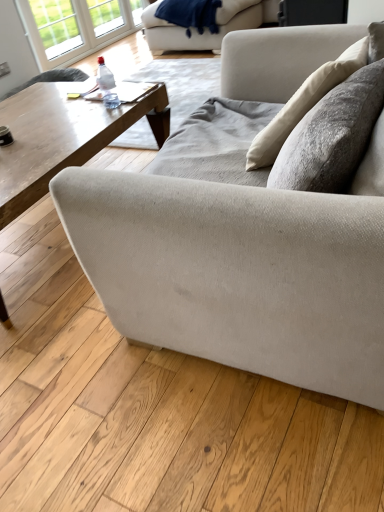
In order to click on white glass window at upper left, the first window in the right-to-left sequence in this screenshot , I will do `click(76, 27)`.

Where is `beige fabric couch at upper center, which ranks as the second studio couch in bottom-to-top order`? beige fabric couch at upper center, which ranks as the second studio couch in bottom-to-top order is located at coordinates (206, 28).

What do you see at coordinates (206, 28) in the screenshot? This screenshot has width=384, height=512. I see `beige fabric couch at upper center, placed as the first studio couch when sorted from back to front` at bounding box center [206, 28].

The height and width of the screenshot is (512, 384). Describe the element at coordinates (62, 137) in the screenshot. I see `wooden coffee table at center` at that location.

In order to click on wooden coffee table at center in this screenshot , I will do 62,137.

The height and width of the screenshot is (512, 384). Identify the location of clear glass window at upper left, which is the first window from left to right. (56, 26).

Can you confirm if white glass window at upper left, the first window in the right-to-left sequence, is shorter than textured beige couch at center, positioned as the 1th studio couch in front-to-back order?

Yes.

Is white glass window at upper left, the first window in the right-to-left sequence, oriented towards textured beige couch at center, the first studio couch in the bottom-to-top sequence?

→ No, white glass window at upper left, the first window in the right-to-left sequence, does not turn towards textured beige couch at center, the first studio couch in the bottom-to-top sequence.

Which object is positioned more to the left, white glass window at upper left, which is the 2th window in left-to-right order, or textured beige couch at center, the 2th studio couch positioned from the back?

From the viewer's perspective, white glass window at upper left, which is the 2th window in left-to-right order, appears more on the left side.

In the image, is white glass window at upper left, which is the 2th window in left-to-right order, positioned in front of or behind textured beige couch at center, the first studio couch in the bottom-to-top sequence?

Visually, white glass window at upper left, which is the 2th window in left-to-right order, is located behind textured beige couch at center, the first studio couch in the bottom-to-top sequence.

Does wooden coffee table at center appear on the right side of textured beige couch at center, positioned as the second studio couch in top-to-bottom order?

No.

Who is smaller, wooden coffee table at center or textured beige couch at center, positioned as the second studio couch in top-to-bottom order?

With smaller size is wooden coffee table at center.

From the image's perspective, is wooden coffee table at center positioned above or below textured beige couch at center, positioned as the second studio couch in top-to-bottom order?

Based on their image positions, wooden coffee table at center is located above textured beige couch at center, positioned as the second studio couch in top-to-bottom order.

Is wooden coffee table at center taller or shorter than textured beige couch at center, the first studio couch in the bottom-to-top sequence?

Clearly, wooden coffee table at center is shorter compared to textured beige couch at center, the first studio couch in the bottom-to-top sequence.

Is point (176, 4) positioned before point (105, 11)?

That is True.

Can you confirm if velvety blue blanket at upper center is wider than white glass window at upper left, the first window in the right-to-left sequence?

Yes.

From a real-world perspective, is velvety blue blanket at upper center beneath white glass window at upper left, which is the 2th window in left-to-right order?

Actually, velvety blue blanket at upper center is physically above white glass window at upper left, which is the 2th window in left-to-right order, in the real world.

Is there a large distance between velvety blue blanket at upper center and white glass window at upper left, which is the 2th window in left-to-right order?

Absolutely, velvety blue blanket at upper center is distant from white glass window at upper left, which is the 2th window in left-to-right order.

Is textured beige couch at center, positioned as the 1th studio couch in front-to-back order, turned away from beige fabric couch at upper center, the first studio couch in the top-to-bottom sequence?

No, textured beige couch at center, positioned as the 1th studio couch in front-to-back order,'s orientation is not away from beige fabric couch at upper center, the first studio couch in the top-to-bottom sequence.

Are textured beige couch at center, the first studio couch in the bottom-to-top sequence, and beige fabric couch at upper center, placed as the first studio couch when sorted from back to front, far apart?

That's right, there is a large distance between textured beige couch at center, the first studio couch in the bottom-to-top sequence, and beige fabric couch at upper center, placed as the first studio couch when sorted from back to front.

Considering the positions of point (292, 86) and point (257, 20), is point (292, 86) closer or farther from the camera than point (257, 20)?

Point (292, 86) is positioned closer to the camera compared to point (257, 20).

From a real-world perspective, which object stands above the other?

clear glass window at upper left, the second window viewed from the right.

Is clear glass window at upper left, which is the first window from left to right, not inside wooden coffee table at center?

clear glass window at upper left, which is the first window from left to right, lies outside wooden coffee table at center's area.

Is clear glass window at upper left, the second window viewed from the right, with wooden coffee table at center?

clear glass window at upper left, the second window viewed from the right, and wooden coffee table at center are not in contact.

Which of these two, clear glass window at upper left, the second window viewed from the right, or wooden coffee table at center, is wider?

wooden coffee table at center.

From the image's perspective, is velvety blue blanket at upper center above textured beige couch at center, the 2th studio couch positioned from the back?

Indeed, from the image's perspective, velvety blue blanket at upper center is shown above textured beige couch at center, the 2th studio couch positioned from the back.

The width and height of the screenshot is (384, 512). In order to click on blanket on the left of textured beige couch at center, positioned as the 1th studio couch in front-to-back order in this screenshot , I will do `click(190, 14)`.

Is velvety blue blanket at upper center smaller than textured beige couch at center, positioned as the 1th studio couch in front-to-back order?

Yes.

Is textured beige couch at center, positioned as the 1th studio couch in front-to-back order, a part of velvety blue blanket at upper center?

No, textured beige couch at center, positioned as the 1th studio couch in front-to-back order, is located outside of velvety blue blanket at upper center.

Which object is further away from the camera, beige fabric couch at upper center, placed as the first studio couch when sorted from back to front, or textured beige couch at center, the first studio couch in the bottom-to-top sequence?

beige fabric couch at upper center, placed as the first studio couch when sorted from back to front, is more distant.

Which of these two, beige fabric couch at upper center, which ranks as the second studio couch in bottom-to-top order, or textured beige couch at center, positioned as the 1th studio couch in front-to-back order, is smaller?

beige fabric couch at upper center, which ranks as the second studio couch in bottom-to-top order.

Measure the distance between beige fabric couch at upper center, which ranks as the second studio couch in bottom-to-top order, and textured beige couch at center, the first studio couch in the bottom-to-top sequence.

beige fabric couch at upper center, which ranks as the second studio couch in bottom-to-top order, and textured beige couch at center, the first studio couch in the bottom-to-top sequence, are 3.45 meters apart.

Can you see beige fabric couch at upper center, the second studio couch positioned from the front, touching textured beige couch at center, positioned as the 1th studio couch in front-to-back order?

No, beige fabric couch at upper center, the second studio couch positioned from the front, is not beside textured beige couch at center, positioned as the 1th studio couch in front-to-back order.

Locate an element on the screen. The width and height of the screenshot is (384, 512). the 2nd window located beneath the textured beige couch at center, the 2th studio couch positioned from the back (from a real-world perspective) is located at coordinates (76, 27).

Identify the location of coffee table on the left of the textured beige couch at center, positioned as the 1th studio couch in front-to-back order. This screenshot has width=384, height=512. (62, 137).

Looking at the image, which one is located further to beige fabric couch at upper center, the second studio couch positioned from the front, clear glass window at upper left, which is the first window from left to right, or white glass window at upper left, which is the 2th window in left-to-right order?

clear glass window at upper left, which is the first window from left to right, lies further to beige fabric couch at upper center, the second studio couch positioned from the front, than the other object.

Considering their positions, is clear glass window at upper left, the second window viewed from the right, positioned closer to velvety blue blanket at upper center than wooden coffee table at center?

clear glass window at upper left, the second window viewed from the right, lies closer to velvety blue blanket at upper center than the other object.

Which object lies nearer to the anchor point clear glass window at upper left, which is the first window from left to right, wooden coffee table at center or textured beige couch at center, positioned as the 1th studio couch in front-to-back order?

The object closer to clear glass window at upper left, which is the first window from left to right, is wooden coffee table at center.

Estimate the real-world distances between objects in this image. Which object is closer to white glass window at upper left, the first window in the right-to-left sequence, wooden coffee table at center or velvety blue blanket at upper center?

velvety blue blanket at upper center lies closer to white glass window at upper left, the first window in the right-to-left sequence, than the other object.

Based on their spatial positions, is clear glass window at upper left, the second window viewed from the right, or velvety blue blanket at upper center closer to beige fabric couch at upper center, the first studio couch in the top-to-bottom sequence?

velvety blue blanket at upper center lies closer to beige fabric couch at upper center, the first studio couch in the top-to-bottom sequence, than the other object.

Estimate the real-world distances between objects in this image. Which object is closer to beige fabric couch at upper center, which ranks as the second studio couch in bottom-to-top order, velvety blue blanket at upper center or white glass window at upper left, the first window in the right-to-left sequence?

The object closer to beige fabric couch at upper center, which ranks as the second studio couch in bottom-to-top order, is velvety blue blanket at upper center.

Estimate the real-world distances between objects in this image. Which object is closer to velvety blue blanket at upper center, textured beige couch at center, positioned as the 1th studio couch in front-to-back order, or white glass window at upper left, the first window in the right-to-left sequence?

Based on the image, white glass window at upper left, the first window in the right-to-left sequence, appears to be nearer to velvety blue blanket at upper center.

From the image, which object appears to be nearer to textured beige couch at center, positioned as the second studio couch in top-to-bottom order, wooden coffee table at center or clear glass window at upper left, the second window viewed from the right?

wooden coffee table at center is closer to textured beige couch at center, positioned as the second studio couch in top-to-bottom order.

Locate an element on the screen. blanket positioned between textured beige couch at center, the first studio couch in the bottom-to-top sequence, and beige fabric couch at upper center, the first studio couch in the top-to-bottom sequence, from near to far is located at coordinates (190, 14).

What are the coordinates of `blanket between textured beige couch at center, the 2th studio couch positioned from the back, and clear glass window at upper left, the second window viewed from the right, along the z-axis` in the screenshot? It's located at (190, 14).

Find the location of `blanket located between white glass window at upper left, which is the 2th window in left-to-right order, and beige fabric couch at upper center, placed as the first studio couch when sorted from back to front, in the left-right direction`. blanket located between white glass window at upper left, which is the 2th window in left-to-right order, and beige fabric couch at upper center, placed as the first studio couch when sorted from back to front, in the left-right direction is located at coordinates pyautogui.click(x=190, y=14).

I want to click on window between textured beige couch at center, positioned as the 1th studio couch in front-to-back order, and white glass window at upper left, the first window in the right-to-left sequence, from front to back, so click(56, 26).